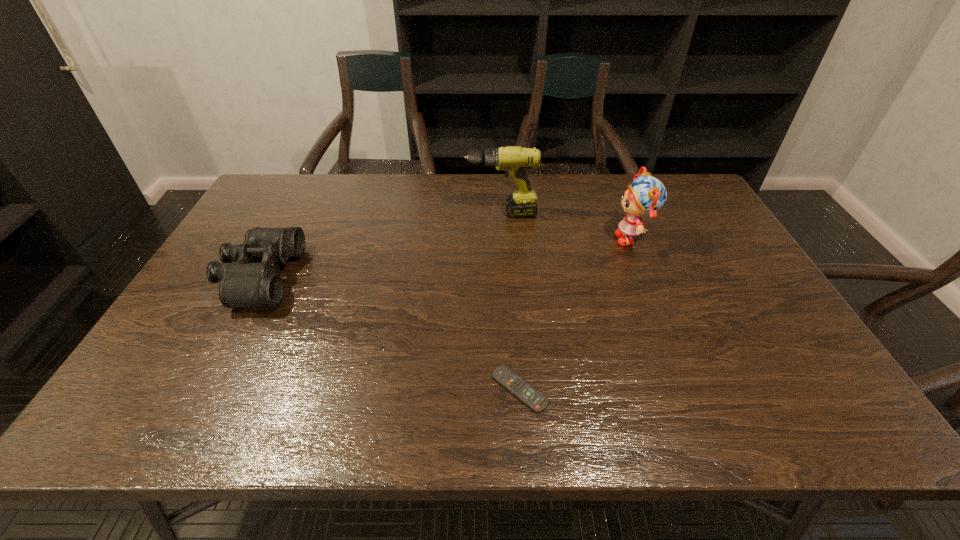
Find the location of a particular element. The height and width of the screenshot is (540, 960). free spot between the binoculars and the rightmost object is located at coordinates (446, 258).

What are the coordinates of `empty space that is in between the drill and the doll` in the screenshot? It's located at (566, 226).

Locate an element on the screen. Image resolution: width=960 pixels, height=540 pixels. vacant area that lies between the doll and the leftmost object is located at coordinates (446, 258).

Where is `free point between the third tallest object and the doll`? free point between the third tallest object and the doll is located at coordinates (446, 258).

You are a GUI agent. You are given a task and a screenshot of the screen. Output one action in this format:
    pyautogui.click(x=<x>, y=<y>)
    Task: Click on the third closest object to the doll
    
    Given the screenshot: What is the action you would take?
    pyautogui.click(x=253, y=279)

This screenshot has width=960, height=540. I want to click on object that is the third closest to the binoculars, so click(646, 195).

Find the location of a particular element. vacant region that satisfies the following two spatial constraints: 1. at the eyepieces of the binoculars; 2. on the back side of the nearest object is located at coordinates (200, 390).

You are a GUI agent. You are given a task and a screenshot of the screen. Output one action in this format:
    pyautogui.click(x=<x>, y=<y>)
    Task: Click on the vacant space that satisfies the following two spatial constraints: 1. on the handle side of the drill; 2. on the right side of the remote control
    This screenshot has width=960, height=540.
    Given the screenshot: What is the action you would take?
    pyautogui.click(x=512, y=390)

Where is `vacant point that satisfies the following two spatial constraints: 1. at the eyepieces of the third tallest object; 2. on the right side of the remote control`? This screenshot has width=960, height=540. vacant point that satisfies the following two spatial constraints: 1. at the eyepieces of the third tallest object; 2. on the right side of the remote control is located at coordinates (200, 390).

Locate an element on the screen. vacant space that satisfies the following two spatial constraints: 1. at the eyepieces of the leftmost object; 2. on the back side of the remote control is located at coordinates (200, 390).